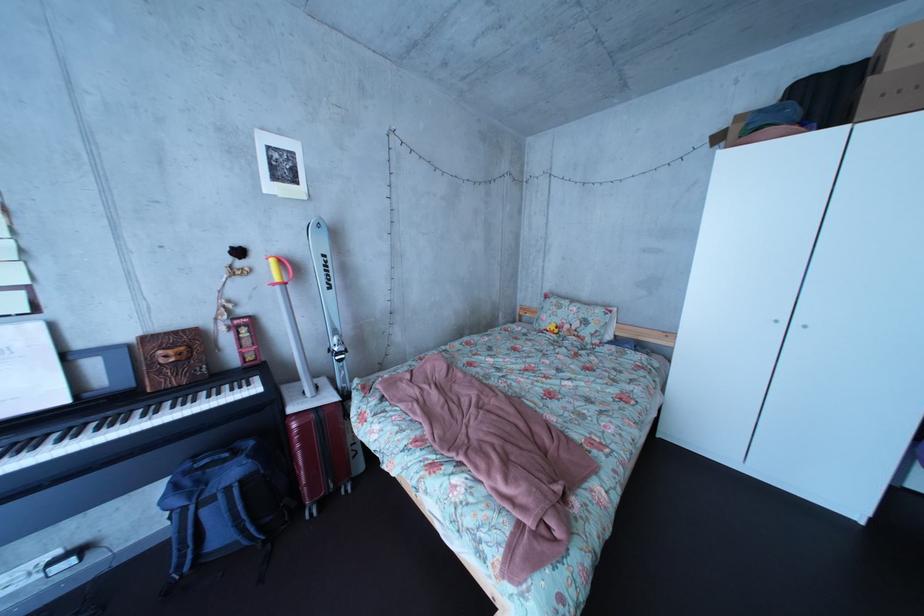
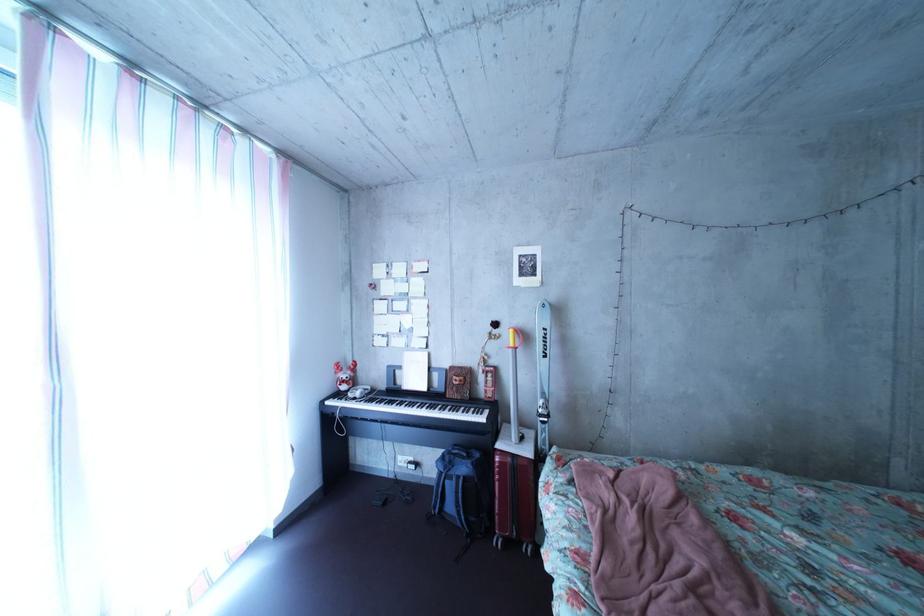
Where in the second image is the point corresponding to point (118, 389) from the first image?

(452, 392)